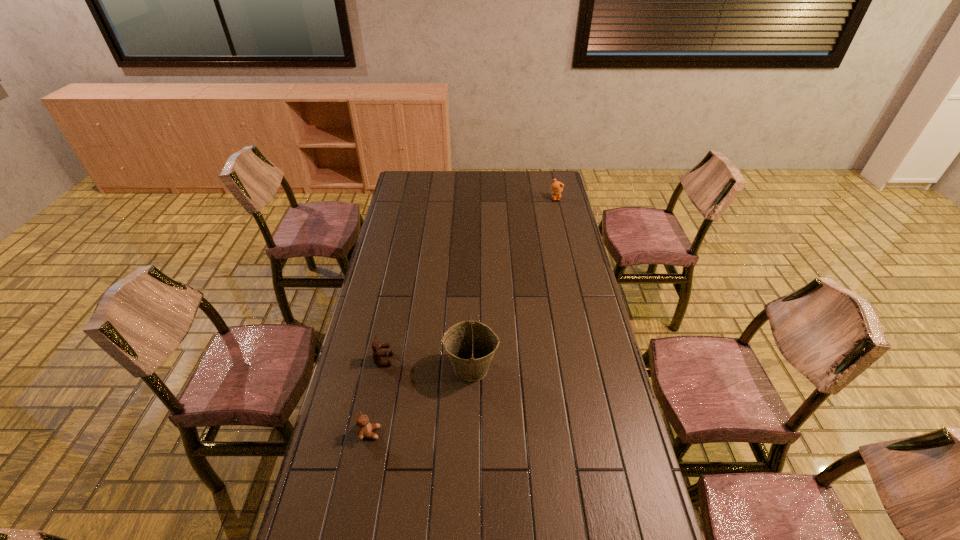
Find the location of a particular element. This screenshot has height=540, width=960. free space between the rightmost teddy bear and the second object from right to left is located at coordinates (514, 283).

This screenshot has height=540, width=960. I want to click on free area in between the farthest teddy bear and the nearest object, so click(x=463, y=316).

Identify the location of empty space between the rightmost teddy bear and the third object from left to right. (514, 283).

Locate an element on the screen. This screenshot has height=540, width=960. blank region between the second farthest teddy bear and the tallest object is located at coordinates (427, 363).

The width and height of the screenshot is (960, 540). In order to click on empty space between the second nearest teddy bear and the wine bucket in this screenshot , I will do `click(427, 363)`.

Identify which object is the third closest to the wine bucket. Please provide its 2D coordinates. Your answer should be formatted as a tuple, i.e. [(x, y)], where the tuple contains the x and y coordinates of a point satisfying the conditions above.

[(557, 187)]

Identify the location of object that is the second closest to the rightmost teddy bear. (377, 354).

At what (x,y) coordinates should I click in order to perform the action: click on teddy bear that is the second nearest to the wine bucket. Please return your answer as a coordinate pair (x, y). The image size is (960, 540). Looking at the image, I should click on (364, 429).

Locate which teddy bear is the third closest to the wine bucket. Please provide its 2D coordinates. Your answer should be formatted as a tuple, i.e. [(x, y)], where the tuple contains the x and y coordinates of a point satisfying the conditions above.

[(557, 187)]

This screenshot has width=960, height=540. What are the coordinates of `free space that satisfies the following two spatial constraints: 1. on the face of the farthest teddy bear; 2. on the front-facing side of the nearest teddy bear` in the screenshot? It's located at (611, 433).